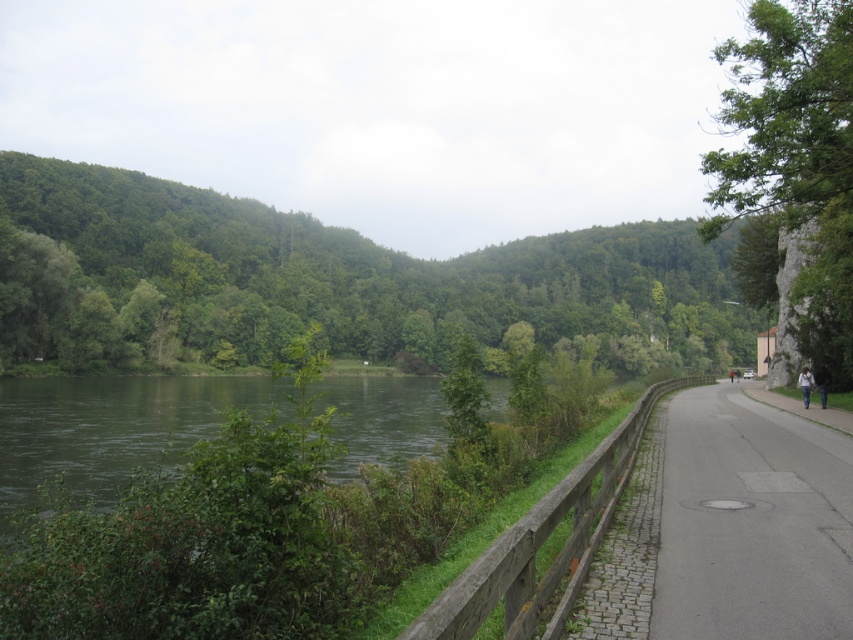
You are standing on the paved pathway and looking towards the river. There are two green leafy trees in view. Which tree, the green leafy tree at center or the green leafy tree at right, would appear closer to you based on their sizes?

The green leafy tree at center appears closer because it is smaller than the green leafy tree at right, and smaller objects often appear farther away due to perspective, but in this case, since it is stated to be smaller, it might actually be closer. Wait, this seems contradictory. Let me think again. In perspective, larger objects are closer. Since the center tree is smaller, it would be farther away. Hmm, the answer might need clarification. The description says the center tree is smaller than the right.

From the picture: You are standing at the riverside and want to walk to the green leafy tree at center. The path is 1.2 meters wide. Can you walk straight to the tree without stepping off the path?

The distance between you and the green leafy tree at center is 84.14 meters. Since the path is 1.2 meters wide, you can walk straight to the tree without stepping off the path as long as you stay within the path width.

Looking at this image, you are a hiker standing on the pathway near the wooden fence at center and the green leafy tree at center. Which object is taller?

The green leafy tree at center is much taller than the wooden fence at center.